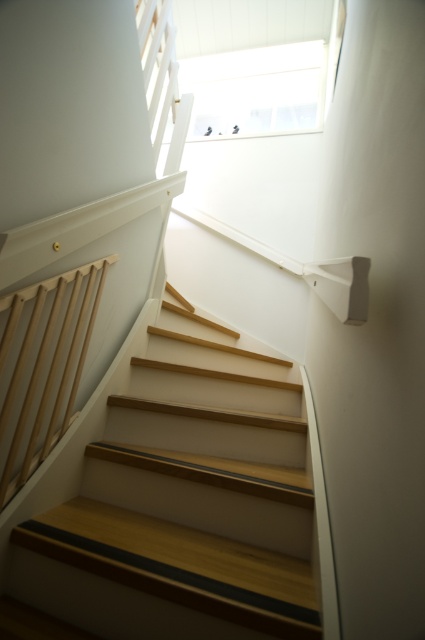
Who is shorter, wooden stairs at center or natural wood railing at left?

wooden stairs at center

Who is higher up, wooden stairs at center or natural wood railing at left?

Positioned higher is natural wood railing at left.

Between point (227, 481) and point (17, 460), which one is positioned in front?

Positioned in front is point (17, 460).

At what (x,y) coordinates should I click in order to perform the action: click on wooden stairs at center. Please return your answer as a coordinate pair (x, y). Looking at the image, I should click on (184, 500).